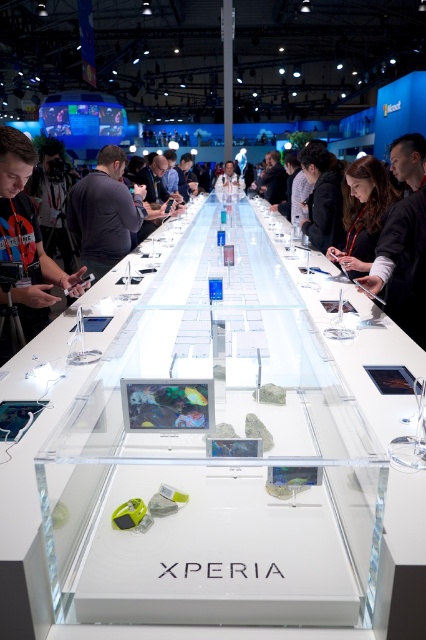
Is transparent acrylic table at center above matte black laptop at upper center?

Actually, transparent acrylic table at center is below matte black laptop at upper center.

Does transparent acrylic table at center have a lesser height compared to matte black laptop at upper center?

Incorrect, transparent acrylic table at center's height does not fall short of matte black laptop at upper center's.

Is point (376, 621) positioned after point (359, 275)?

No.

The height and width of the screenshot is (640, 426). What are the coordinates of `transparent acrylic table at center` in the screenshot? It's located at (210, 451).

Which is above, dark gray fabric shirt at left or black fabric jacket at center?

black fabric jacket at center

Who is more distant from viewer, [49,301] or [316,172]?

The point [316,172] is behind.

Does point (8, 216) come closer to viewer compared to point (307, 157)?

That is True.

Image resolution: width=426 pixels, height=640 pixels. Identify the location of dark gray fabric shirt at left. (28, 236).

Based on the photo, between matte black laptop at upper center and black fabric person at center, which one is positioned higher?

Positioned higher is black fabric person at center.

Is point (357, 211) positioned behind point (227, 170)?

No, it is in front of (227, 170).

Locate an element on the screen. This screenshot has height=640, width=426. matte black laptop at upper center is located at coordinates (362, 214).